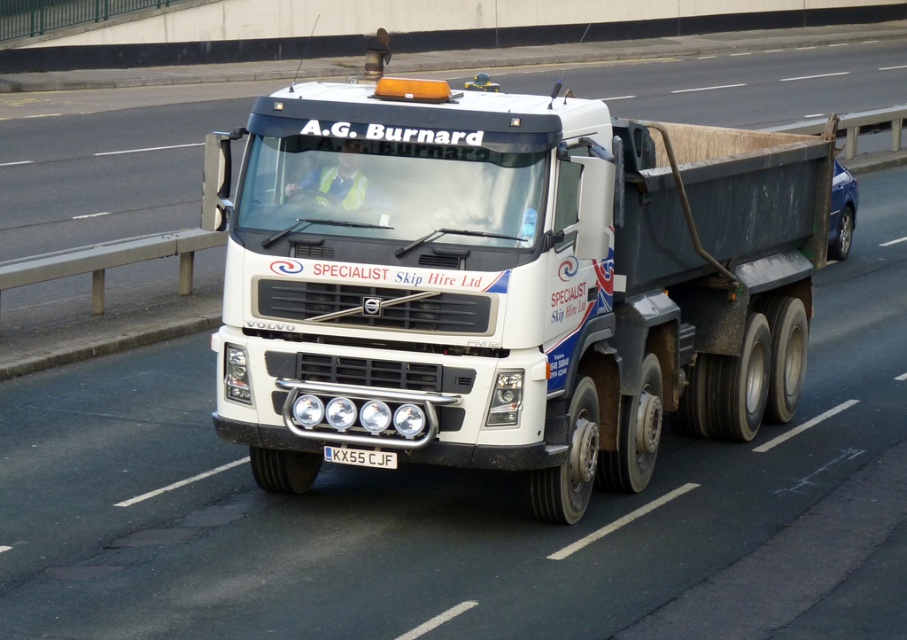
Question: Is white matte truck at center positioned before black metal license plate at center?

Choices:
 (A) no
 (B) yes

Answer: (B)

Question: Is the position of white matte truck at center less distant than that of black metal license plate at center?

Choices:
 (A) no
 (B) yes

Answer: (B)

Question: Among these objects, which one is farthest from the camera?

Choices:
 (A) black metal license plate at center
 (B) white matte truck at center

Answer: (A)

Question: Is the position of white matte truck at center less distant than that of black metal license plate at center?

Choices:
 (A) no
 (B) yes

Answer: (B)

Question: Which point is farther to the camera?

Choices:
 (A) (384, 452)
 (B) (744, 188)

Answer: (B)

Question: Among these points, which one is nearest to the camera?

Choices:
 (A) (446, 444)
 (B) (359, 461)

Answer: (A)